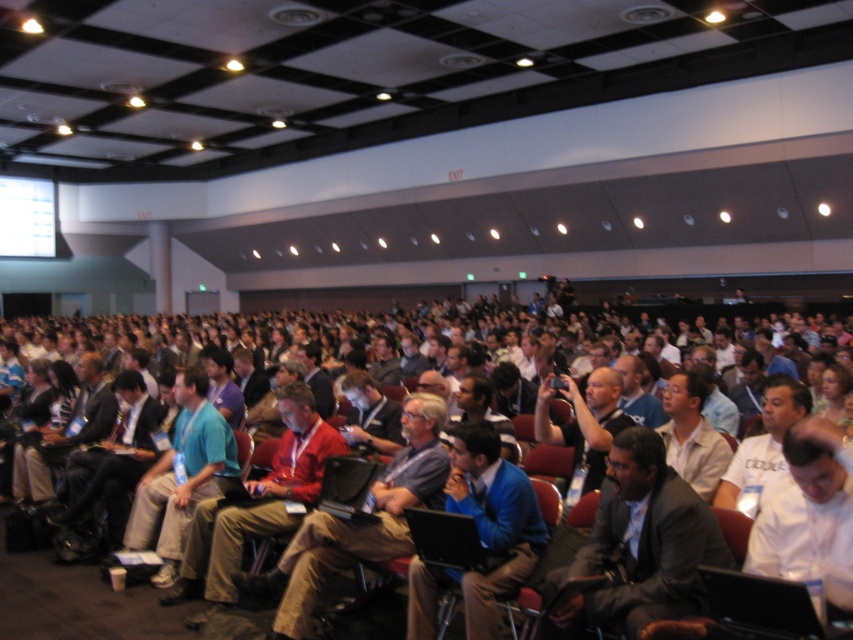
Which is more to the right, dark gray suit at center or blue fabric shirt at center?

dark gray suit at center

Can you confirm if dark gray suit at center is positioned to the right of blue fabric shirt at center?

Yes, dark gray suit at center is to the right of blue fabric shirt at center.

Where is `dark gray suit at center`? dark gray suit at center is located at coordinates (639, 545).

Locate an element on the screen. blue fabric shirt at center is located at coordinates (480, 534).

Is blue fabric shirt at center shorter than red fabric shirt at center?

Yes, blue fabric shirt at center is shorter than red fabric shirt at center.

Find the location of a particular element. The width and height of the screenshot is (853, 640). blue fabric shirt at center is located at coordinates (480, 534).

Identify the location of blue fabric shirt at center. click(x=480, y=534).

Is dark gray suit at center positioned before red fabric shirt at center?

Yes, dark gray suit at center is in front of red fabric shirt at center.

Who is more forward, (630,579) or (354,529)?

Positioned in front is point (630,579).

Locate an element on the screen. dark gray suit at center is located at coordinates (639, 545).